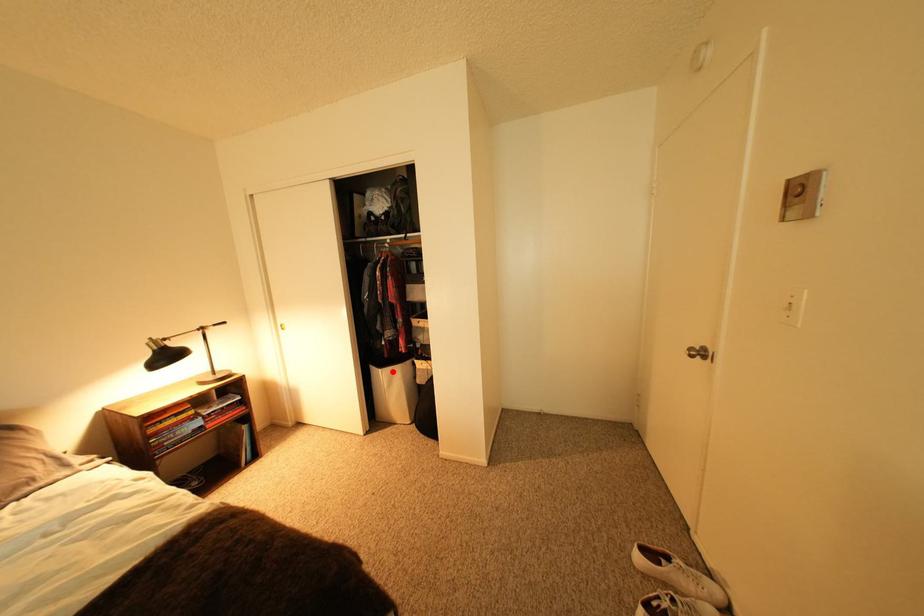
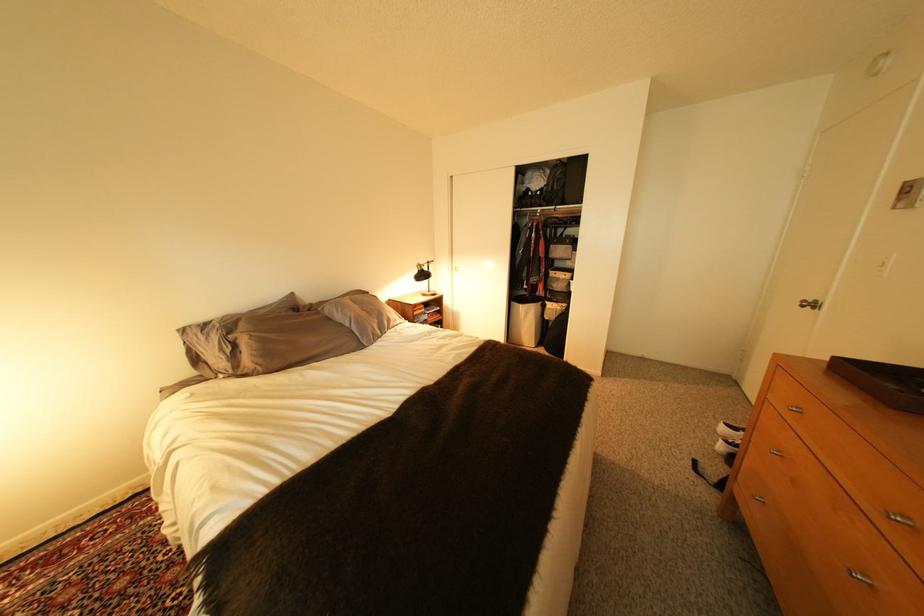
Locate, in the second image, the point that corresponds to the highlighted location in the first image.

(533, 307)